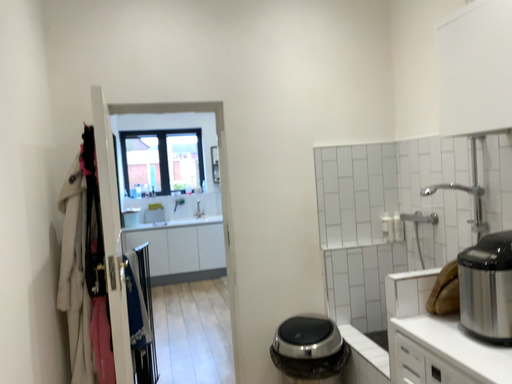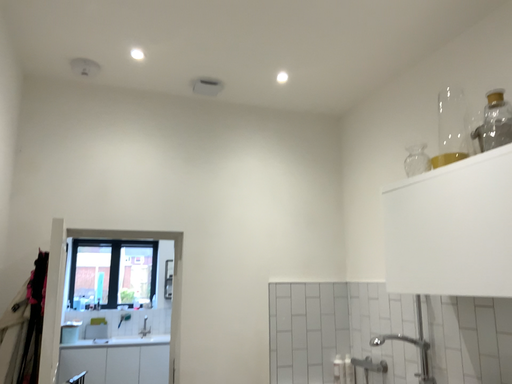
Question: Which way did the camera rotate in the video?

Choices:
 (A) rotated right
 (B) rotated left

Answer: (A)